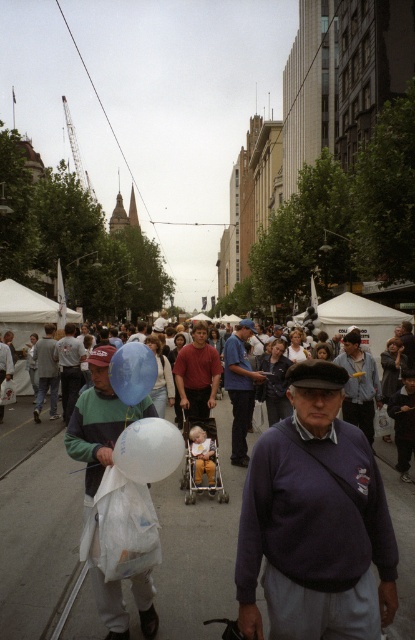
Consider the image. You are a photographer standing on the street and want to capture a person wearing both the blue fabric shirt at center and denim jeans at center. Which clothing item will appear shorter in your photo?

The blue fabric shirt at center will appear shorter in the photo because it has a lesser height compared to the denim jeans at center.

You are a street performer standing at the edge of the crowd. You notice a translucent plastic bag at center and denim jeans at center. Since you want to retrieve both items, which one should you move towards first if you are currently at the starting point equidistant from both?

Both the translucent plastic bag at center and denim jeans at center are 9.50 meters apart from each other, but since you are equidistant from both, you can choose either one first as your starting point is the same distance to both items.

You are standing on the street in the image and see the translucent plastic bag at center. If you want to pick it up, which direction should you move relative to your current position?

The translucent plastic bag at center is located at coordinates point (100, 419). Since it is at the center of the image, you should move forward to reach it.